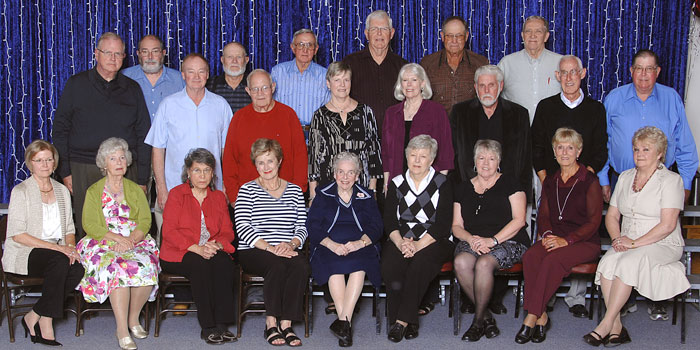
Where is `brown folding metal chair`? brown folding metal chair is located at coordinates (20, 280).